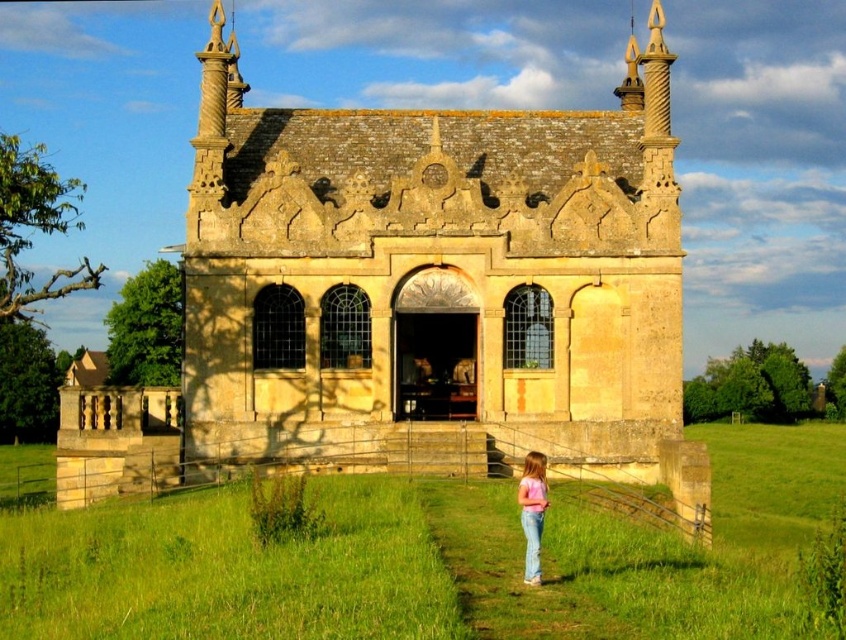
In the scene shown: Is green grass at lower center wider than pink cotton shirt at lower center?

Indeed, green grass at lower center has a greater width compared to pink cotton shirt at lower center.

Can you confirm if green grass at lower center is positioned above pink cotton shirt at lower center?

No, green grass at lower center is not above pink cotton shirt at lower center.

Measure the distance between point (232,627) and camera.

Point (232,627) and camera are 149.98 feet apart.

In order to click on green grass at lower center in this screenshot , I will do `click(432, 560)`.

Is yellow stone church at center above green grass at lower center?

Indeed, yellow stone church at center is positioned over green grass at lower center.

Who is more distant from viewer, (257, 138) or (12, 529)?

Point (257, 138)

Where is `yellow stone church at center`? The width and height of the screenshot is (846, 640). yellow stone church at center is located at coordinates (420, 296).

Between point (503, 195) and point (536, 467), which one is positioned in front?

Point (536, 467)

Does point (349, 397) lie in front of point (526, 508)?

No, it is not.

Locate an element on the screen. This screenshot has height=640, width=846. yellow stone church at center is located at coordinates (420, 296).